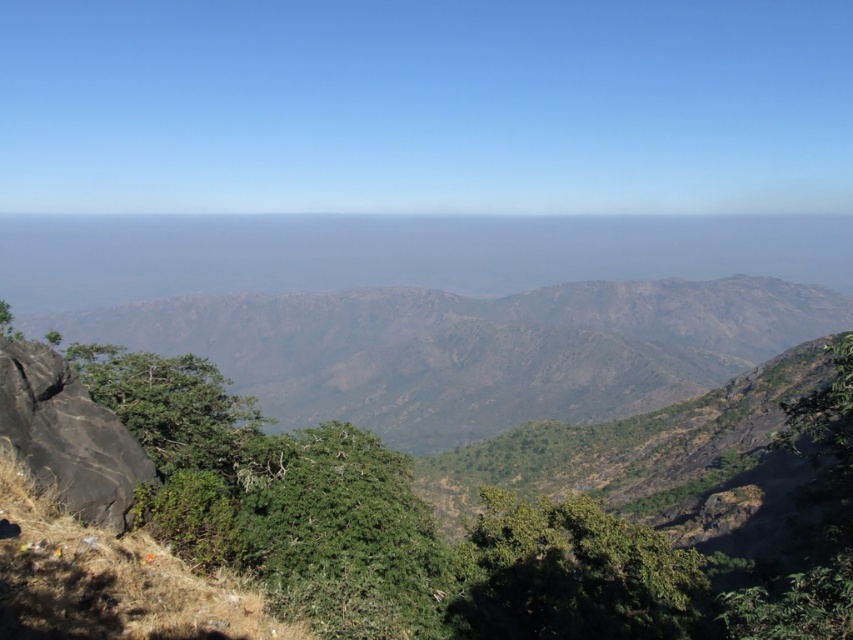
Question: In this image, where is brown rocky mountain at left located relative to black rock at left?

Choices:
 (A) above
 (B) below

Answer: (B)

Question: Can you confirm if brown rocky mountain at left is wider than black rock at left?

Choices:
 (A) yes
 (B) no

Answer: (A)

Question: Which object is farther from the camera taking this photo?

Choices:
 (A) black rock at left
 (B) brown rocky mountain at left

Answer: (B)

Question: Does brown rocky mountain at left appear on the right side of black rock at left?

Choices:
 (A) no
 (B) yes

Answer: (B)